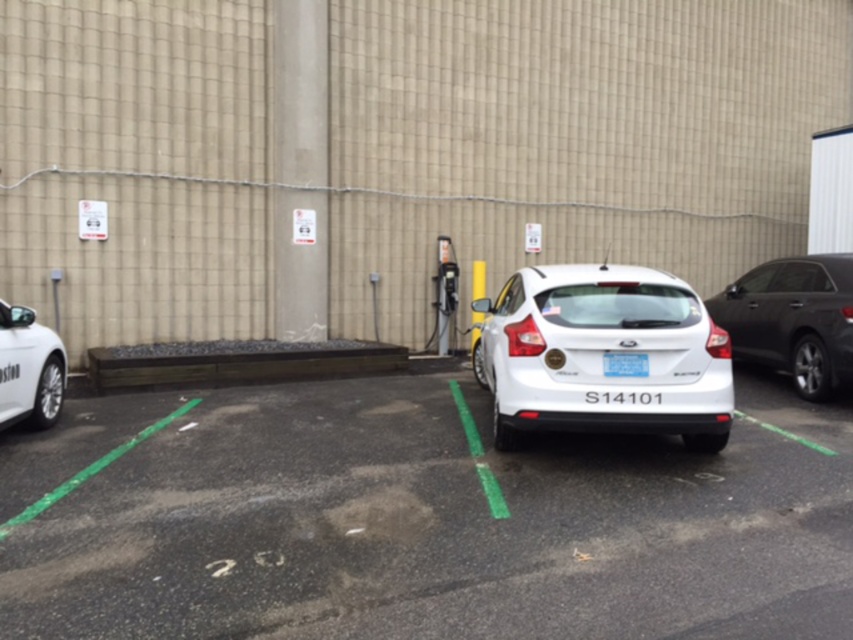
Does white glossy car at center lie behind white matte hatchback at center?

No, white glossy car at center is in front of white matte hatchback at center.

Between white glossy car at center and white matte hatchback at center, which one appears on the right side from the viewer's perspective?

white glossy car at center

The image size is (853, 640). In order to click on white glossy car at center in this screenshot , I will do `click(422, 522)`.

Which is behind, point (659, 369) or point (776, 276)?

Positioned behind is point (776, 276).

Is point (688, 385) behind point (805, 376)?

That is False.

The height and width of the screenshot is (640, 853). Describe the element at coordinates (602, 355) in the screenshot. I see `white matte hatchback at center` at that location.

Where is `white matte hatchback at center`? white matte hatchback at center is located at coordinates (602, 355).

Can you confirm if white matte car at left is positioned below blue matte license plate at center?

Correct, white matte car at left is located below blue matte license plate at center.

Who is more forward, (45,356) or (643,369)?

Point (643,369) is in front.

Describe the element at coordinates (28, 369) in the screenshot. I see `white matte car at left` at that location.

Image resolution: width=853 pixels, height=640 pixels. What are the coordinates of `white matte car at left` in the screenshot? It's located at (28, 369).